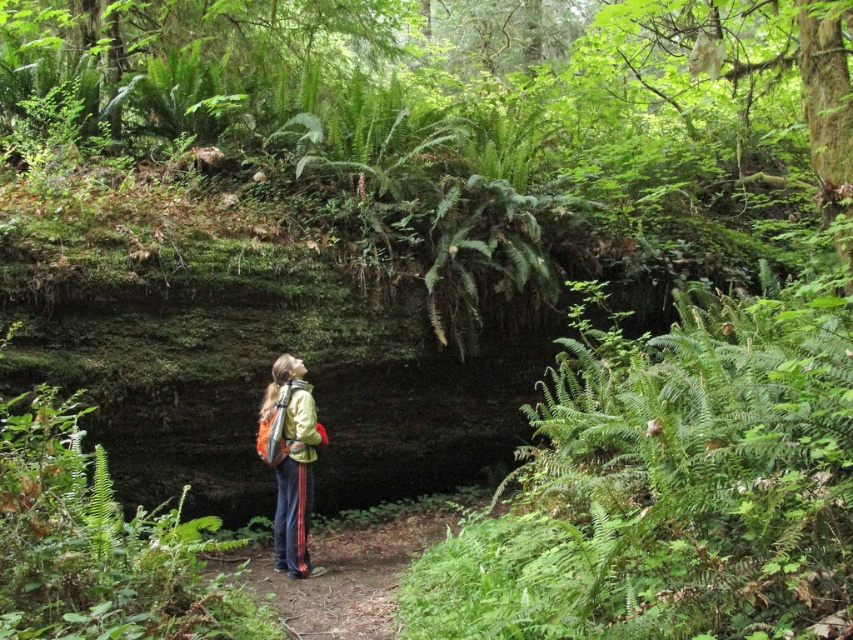
Question: In this image, where is brown dirt trail at center located relative to green matte jacket at center?

Choices:
 (A) above
 (B) below

Answer: (B)

Question: Is brown dirt trail at center to the left of green matte jacket at center from the viewer's perspective?

Choices:
 (A) yes
 (B) no

Answer: (B)

Question: Does brown dirt trail at center appear on the left side of green matte jacket at center?

Choices:
 (A) yes
 (B) no

Answer: (B)

Question: Which object is closer to the camera taking this photo?

Choices:
 (A) green matte jacket at center
 (B) brown dirt trail at center

Answer: (B)

Question: Which point is farther to the camera?

Choices:
 (A) green matte jacket at center
 (B) brown dirt trail at center

Answer: (A)